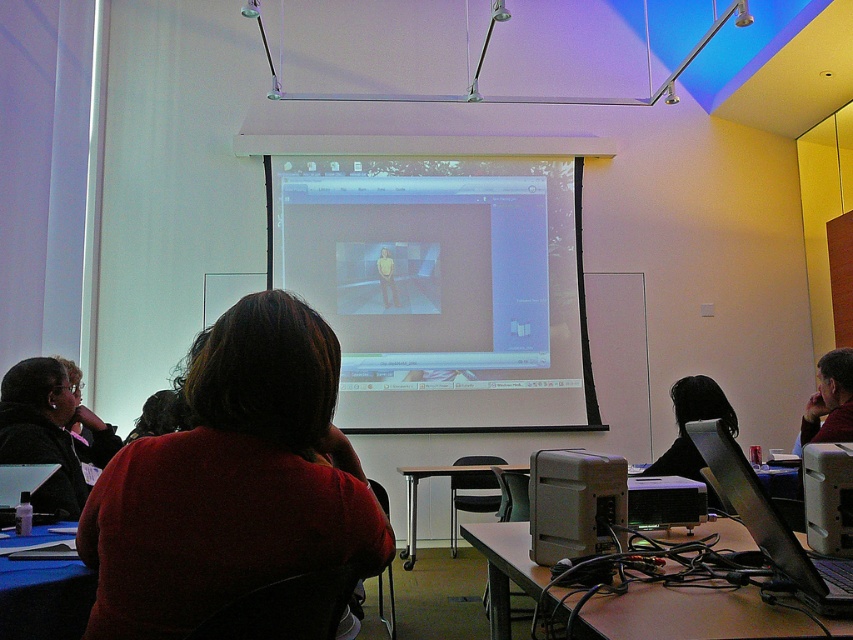
You are standing in the classroom facing the projection screen. There is a point marked at coordinates (665, 500). What object is located at that point?

The point at coordinates (665, 500) corresponds to the matte black projector at center.

You are a student sitting at the blue fabric table at lower left and need to reach the matte black laptop at lower left to take notes. Is the laptop within easy reach from your current position?

The blue fabric table at lower left is positioned under the matte black laptop at lower left, so the laptop is likely within easy reach since it is placed directly above the table.

You are a student sitting at the blue fabric table at lower left and need to access your matte black laptop at lower left. Can you reach it without moving your chair?

The blue fabric table at lower left is in front of the matte black laptop at lower left, meaning the laptop is behind the table. Since the table is between you and the laptop, you would need to move your chair or go around the table to reach it.